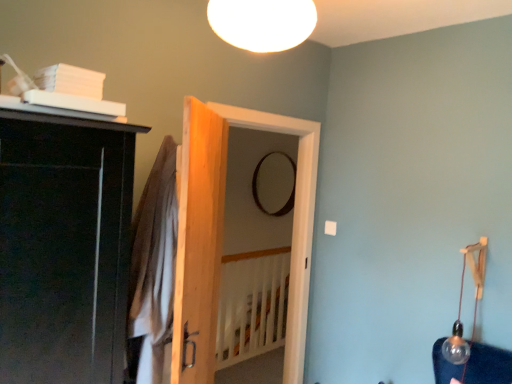
Question: Does black matte mirror at center have a greater width compared to natural wood door at center, which is the 2th door in back-to-front order?

Choices:
 (A) yes
 (B) no

Answer: (B)

Question: Is black matte mirror at center thinner than natural wood door at center, which is the 2th door in back-to-front order?

Choices:
 (A) no
 (B) yes

Answer: (B)

Question: Is black matte mirror at center to the right of natural wood door at center, placed as the 1th door when sorted from front to back, from the viewer's perspective?

Choices:
 (A) no
 (B) yes

Answer: (B)

Question: Does black matte mirror at center lie in front of natural wood door at center, placed as the 1th door when sorted from front to back?

Choices:
 (A) no
 (B) yes

Answer: (A)

Question: From a real-world perspective, does black matte mirror at center stand above natural wood door at center, which is the 2th door in back-to-front order?

Choices:
 (A) no
 (B) yes

Answer: (B)

Question: Can you confirm if black matte mirror at center is bigger than natural wood door at center, which is the 2th door in back-to-front order?

Choices:
 (A) yes
 (B) no

Answer: (B)

Question: Does white matte ceiling light at upper center, acting as the first lamp starting from the front, appear on the right side of wooden door at center, which appears as the second door when viewed from the front?

Choices:
 (A) no
 (B) yes

Answer: (A)

Question: Is wooden door at center, which appears as the second door when viewed from the front, at the back of white matte ceiling light at upper center, the second lamp viewed from the back?

Choices:
 (A) yes
 (B) no

Answer: (B)

Question: Considering the relative positions of white matte ceiling light at upper center, acting as the first lamp starting from the front, and wooden door at center, which appears as the second door when viewed from the front, in the image provided, is white matte ceiling light at upper center, acting as the first lamp starting from the front, in front of wooden door at center, which appears as the second door when viewed from the front,?

Choices:
 (A) no
 (B) yes

Answer: (B)

Question: Does white matte ceiling light at upper center, acting as the first lamp starting from the front, have a greater width compared to wooden door at center, which appears as the second door when viewed from the front?

Choices:
 (A) yes
 (B) no

Answer: (A)

Question: Does white matte ceiling light at upper center, acting as the first lamp starting from the front, come behind wooden door at center, positioned as the first door in back-to-front order?

Choices:
 (A) yes
 (B) no

Answer: (B)

Question: Is white matte ceiling light at upper center, which is the second lamp from bottom to top, shorter than wooden door at center, positioned as the first door in back-to-front order?

Choices:
 (A) no
 (B) yes

Answer: (B)

Question: Is white wooden bed frame at center next to clear glass bulb at right, arranged as the first lamp when viewed from the right, and touching it?

Choices:
 (A) no
 (B) yes

Answer: (A)